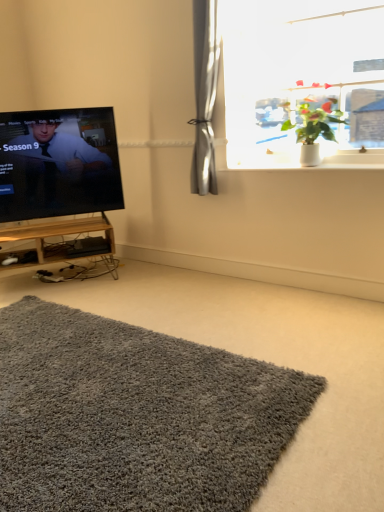
Question: Can you confirm if green leafy plant at upper right is bigger than woodenmaterial tv stand at left?

Choices:
 (A) yes
 (B) no

Answer: (A)

Question: Considering the relative sizes of green leafy plant at upper right and woodenmaterial tv stand at left in the image provided, is green leafy plant at upper right thinner than woodenmaterial tv stand at left?

Choices:
 (A) yes
 (B) no

Answer: (A)

Question: Is green leafy plant at upper right completely or partially outside of woodenmaterial tv stand at left?

Choices:
 (A) no
 (B) yes

Answer: (B)

Question: Is green leafy plant at upper right positioned behind woodenmaterial tv stand at left?

Choices:
 (A) no
 (B) yes

Answer: (A)

Question: Can you confirm if green leafy plant at upper right is wider than woodenmaterial tv stand at left?

Choices:
 (A) yes
 (B) no

Answer: (B)

Question: Considering the positions of point (268, 147) and point (59, 251), is point (268, 147) closer or farther from the camera than point (59, 251)?

Choices:
 (A) closer
 (B) farther

Answer: (A)

Question: From the image's perspective, is green leafy plant at upper right positioned above or below woodenmaterial tv stand at left?

Choices:
 (A) below
 (B) above

Answer: (B)

Question: Considering their positions, is green leafy plant at upper right located in front of or behind woodenmaterial tv stand at left?

Choices:
 (A) front
 (B) behind

Answer: (A)

Question: From a real-world perspective, is green leafy plant at upper right positioned above or below woodenmaterial tv stand at left?

Choices:
 (A) below
 (B) above

Answer: (B)

Question: Considering the positions of point (105, 415) and point (94, 147), is point (105, 415) closer or farther from the camera than point (94, 147)?

Choices:
 (A) farther
 (B) closer

Answer: (B)

Question: From a real-world perspective, is gray shaggy rug at lower center above or below black glossy tv at left?

Choices:
 (A) above
 (B) below

Answer: (B)

Question: From their relative heights in the image, would you say gray shaggy rug at lower center is taller or shorter than black glossy tv at left?

Choices:
 (A) tall
 (B) short

Answer: (B)

Question: From the image's perspective, is gray shaggy rug at lower center above or below black glossy tv at left?

Choices:
 (A) below
 (B) above

Answer: (A)

Question: Considering the positions of point (91, 273) and point (235, 162), is point (91, 273) closer or farther from the camera than point (235, 162)?

Choices:
 (A) closer
 (B) farther

Answer: (B)

Question: From their relative heights in the image, would you say woodenmaterial tv stand at left is taller or shorter than white glossy window sill at upper right?

Choices:
 (A) short
 (B) tall

Answer: (B)